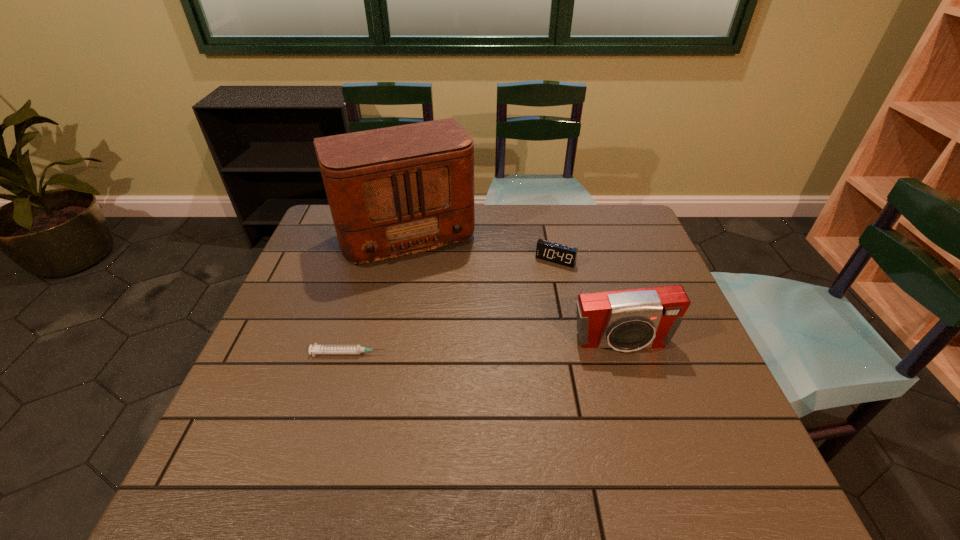
Image resolution: width=960 pixels, height=540 pixels. Identify the location of vacant region at the far left corner of the desktop. (316, 229).

The height and width of the screenshot is (540, 960). I want to click on vacant region at the far right corner, so click(604, 210).

Identify the location of unoccupied position between the shortest object and the radio receiver. (374, 294).

Find the location of a particular element. The width and height of the screenshot is (960, 540). free space that is in between the second tallest object and the tallest object is located at coordinates (511, 289).

The height and width of the screenshot is (540, 960). I want to click on vacant space that is in between the camera and the radio receiver, so click(511, 289).

This screenshot has height=540, width=960. Identify the location of vacant space that is in between the syringe and the radio receiver. (374, 294).

Where is `free space between the third shortest object and the shortest object`? The height and width of the screenshot is (540, 960). free space between the third shortest object and the shortest object is located at coordinates (486, 348).

I want to click on free spot between the third tallest object and the shortest object, so click(x=452, y=307).

This screenshot has width=960, height=540. Identify the location of vacant region between the syringe and the alarm clock. (452, 307).

Identify the location of the second closest object relative to the third shortest object. (395, 191).